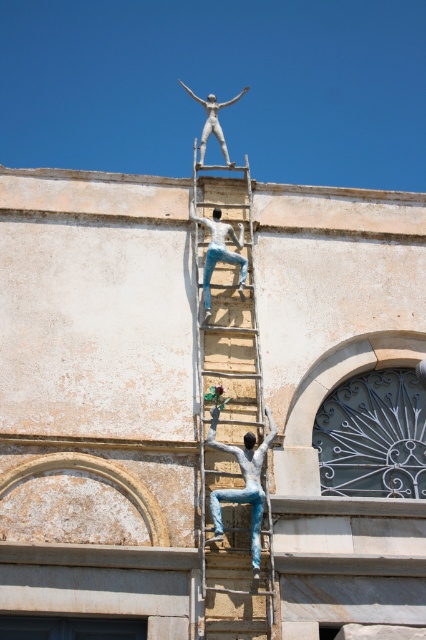
You are an art curator planning to install a new sculpture between the wooden ladder at upper center and the white glossy statue at center. Based on their positions, where should the new sculpture be placed?

The wooden ladder at upper center is located above the white glossy statue at center, so the new sculpture should be placed between them in the space below the wooden ladder at upper center and above the white glossy statue at center.

You are an art curator planning to install a new sculpture between the wooden ladder at upper center and the silver metallic statue at upper center. Given their relative sizes, which object should the sculpture be placed closer to and why?

The sculpture should be placed closer to the silver metallic statue at upper center because the wooden ladder at upper center is thinner than the silver metallic statue at upper center, making the statue a better anchor point for the new sculpture in terms of visual balance.